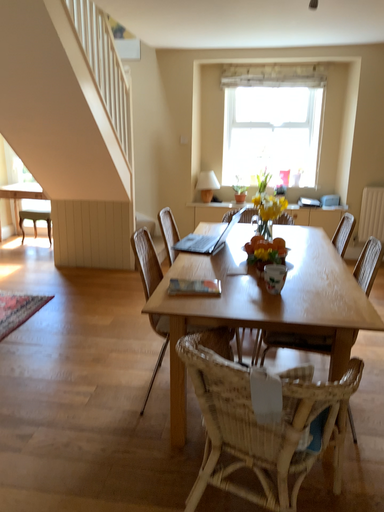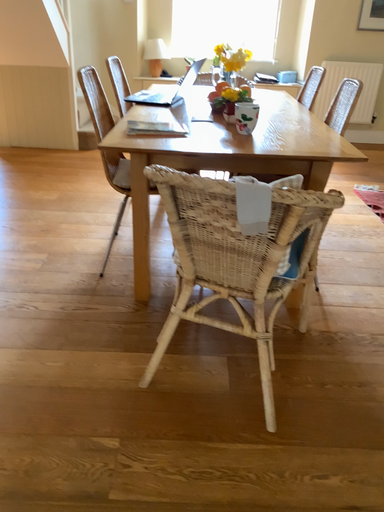
Question: Which way did the camera rotate in the video?

Choices:
 (A) rotated right
 (B) rotated left

Answer: (A)